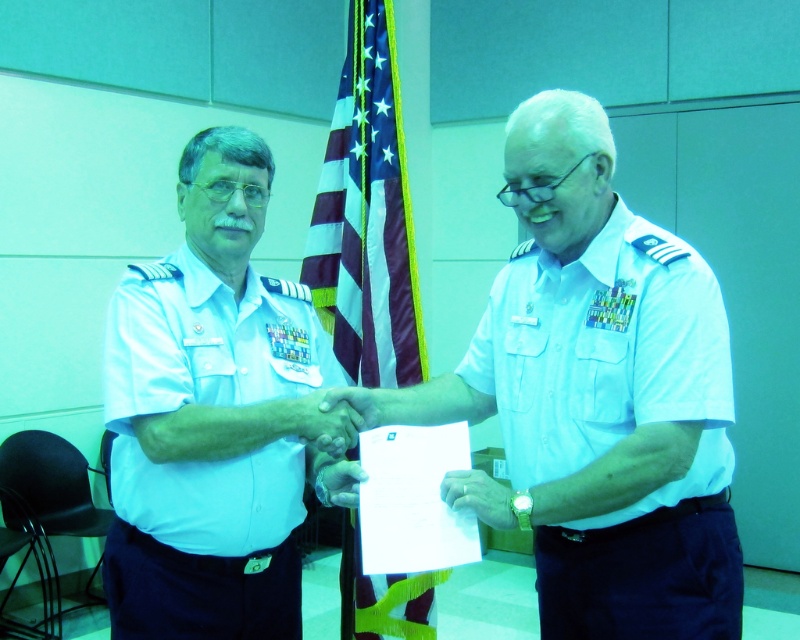
Question: Which of the following is the farthest from the observer?

Choices:
 (A) american flag at center
 (B) white matte hand at center

Answer: (A)

Question: Which object is farther from the camera taking this photo?

Choices:
 (A) white matte hand at center
 (B) white cotton shirt at center
 (C) white cotton shirt at left

Answer: (A)

Question: Does white cotton shirt at center lie behind american flag at center?

Choices:
 (A) no
 (B) yes

Answer: (A)

Question: Does american flag at center appear on the left side of white matte hand at center?

Choices:
 (A) yes
 (B) no

Answer: (A)

Question: Which object is closer to the camera taking this photo?

Choices:
 (A) white cotton shirt at center
 (B) white cotton shirt at left

Answer: (A)

Question: Does white cotton shirt at center have a greater width compared to white matte hand at center?

Choices:
 (A) no
 (B) yes

Answer: (B)